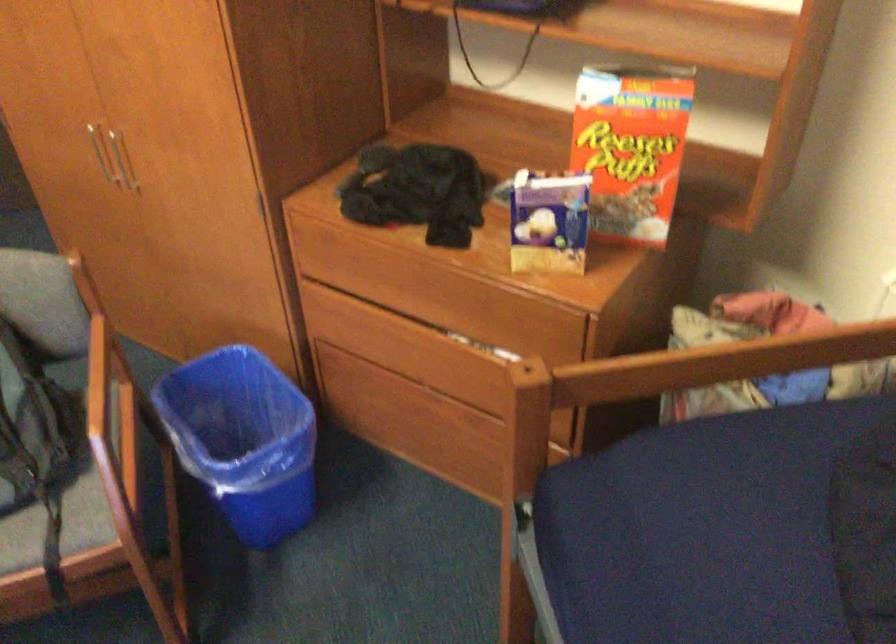
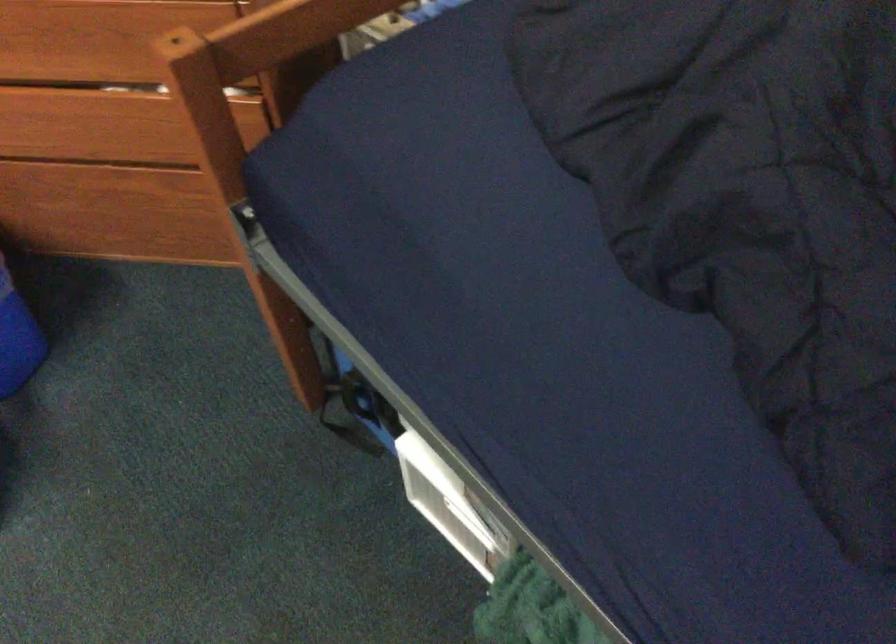
The images are taken continuously from a first-person perspective. In which direction are you moving?

The cameraman moved toward right, forward.